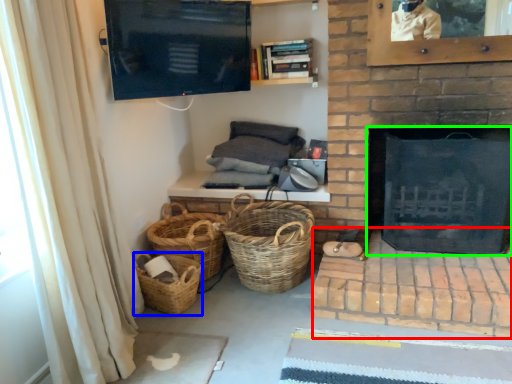
Question: Which object is positioned farthest from brickwork (highlighted by a red box)? Select from basket (highlighted by a blue box) and fireplace (highlighted by a green box).

Choices:
 (A) basket
 (B) fireplace

Answer: (A)